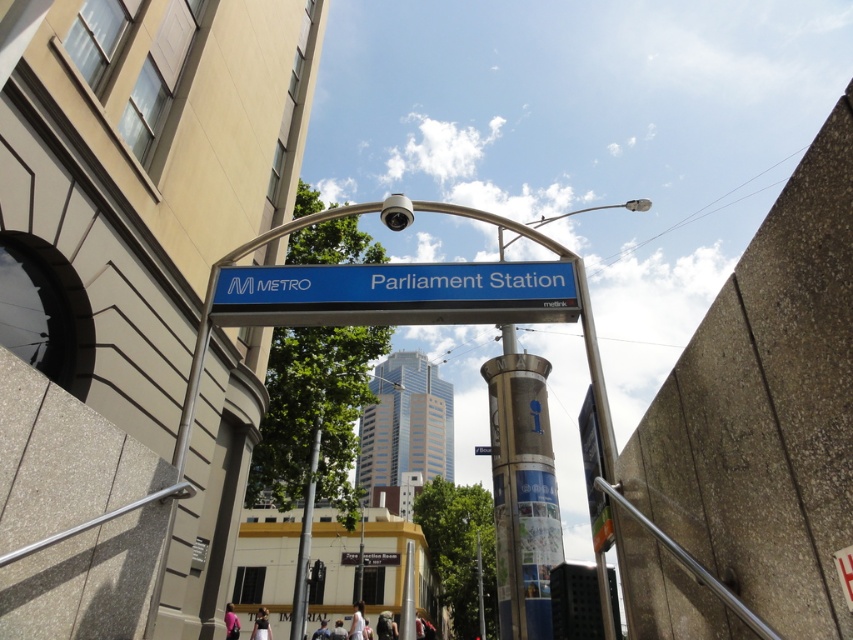
Who is shorter, blue metallic sign at center or silver metallic pole at center?

Standing shorter between the two is blue metallic sign at center.

Which is below, blue metallic sign at center or silver metallic pole at center?

silver metallic pole at center is lower down.

Where is `blue metallic sign at center`? blue metallic sign at center is located at coordinates 395,292.